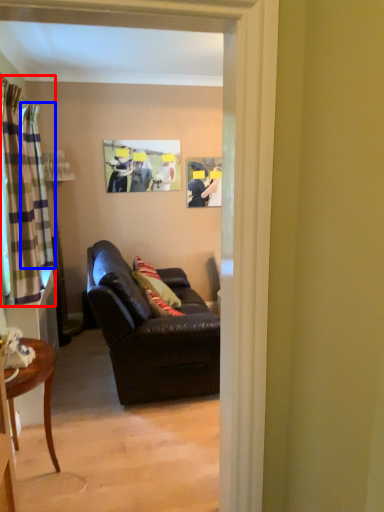
Question: Which object is further to the camera taking this photo, curtain (highlighted by a red box) or curtain (highlighted by a blue box)?

Choices:
 (A) curtain
 (B) curtain

Answer: (B)